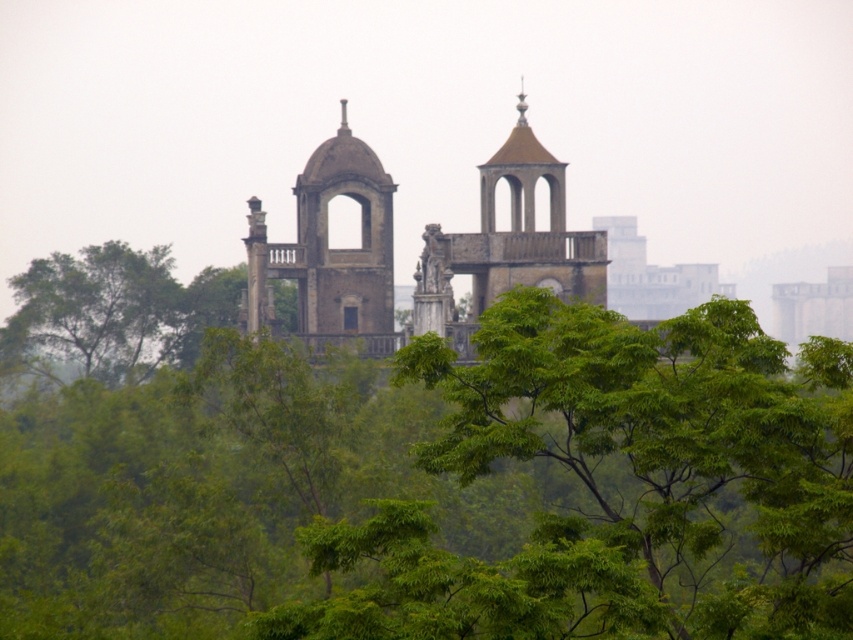
You are standing at the entrance of the old structure and see the point marked as point (331,252). Which object does this point correspond to?

The point (331,252) corresponds to the stone archway at center.